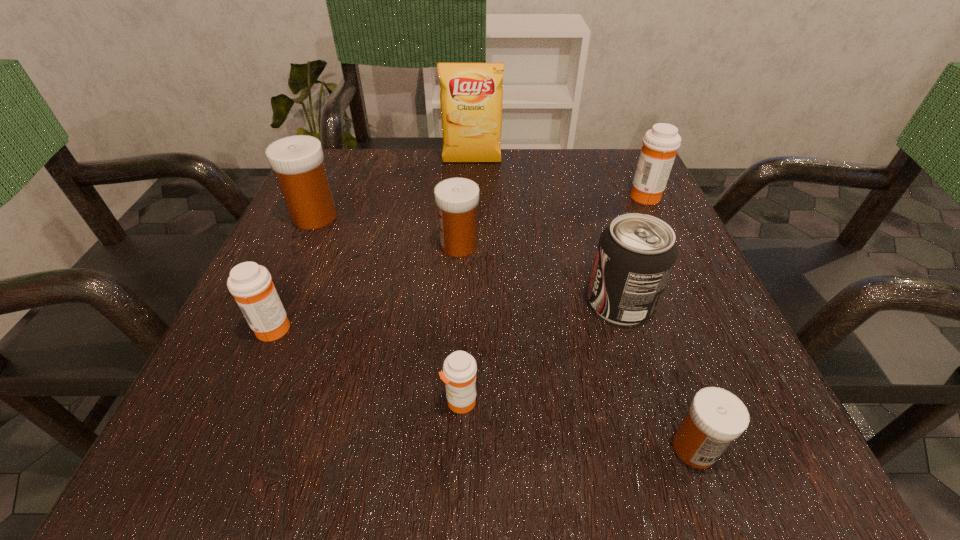
Identify the location of free spot between the farthest white medicine and the black soda can. The height and width of the screenshot is (540, 960). (468, 260).

You are a GUI agent. You are given a task and a screenshot of the screen. Output one action in this format:
    pyautogui.click(x=<x>, y=<y>)
    Task: Click on the free space between the tallest object and the soda can
    This screenshot has height=540, width=960.
    Given the screenshot: What is the action you would take?
    pyautogui.click(x=546, y=233)

Identify the location of vacant point located between the farthest object and the smallest orange medicine. The height and width of the screenshot is (540, 960). (466, 282).

This screenshot has height=540, width=960. Identify the location of free area in between the second biggest orange medicine and the farthest white medicine. (294, 272).

You are a GUI agent. You are given a task and a screenshot of the screen. Output one action in this format:
    pyautogui.click(x=<x>, y=<y>)
    Task: Click on the free area in between the fifth medicine from left to right and the fifth nearest object
    
    Given the screenshot: What is the action you would take?
    pyautogui.click(x=577, y=347)

Identify the location of the fourth closest object to the leftmost white medicine. This screenshot has width=960, height=540. point(459,371).

This screenshot has height=540, width=960. Find the location of `the fifth closest object relative to the third farthest medicine`. the fifth closest object relative to the third farthest medicine is located at coordinates (459, 371).

At what (x,y) coordinates should I click in order to perform the action: click on medicine that stands as the third closest to the biggest orange medicine. Please return your answer as a coordinate pair (x, y). This screenshot has height=540, width=960. Looking at the image, I should click on (459, 371).

You are a GUI agent. You are given a task and a screenshot of the screen. Output one action in this format:
    pyautogui.click(x=<x>, y=<y>)
    Task: Click on the medicine object that ranks as the second closest to the rightmost object
    This screenshot has width=960, height=540.
    Given the screenshot: What is the action you would take?
    pyautogui.click(x=716, y=417)

I want to click on orange medicine that stands as the third closest to the nearest object, so click(x=251, y=284).